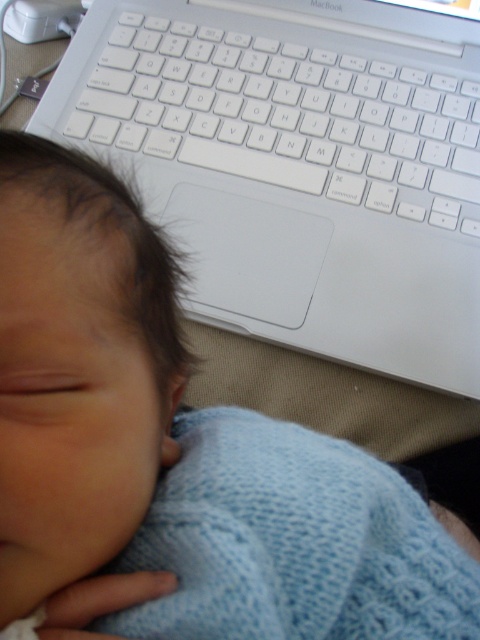
At what (x,y) coordinates should I click in order to perform the action: click on soft blue knit at lower left. Please return your answer as a coordinate pair (x, y). This screenshot has height=640, width=480. Looking at the image, I should click on (78, 368).

Consider the image. Between soft blue knit at lower left and knitted blue blanket at lower left, which one has less height?

With less height is knitted blue blanket at lower left.

Where is `soft blue knit at lower left`? This screenshot has width=480, height=640. soft blue knit at lower left is located at coordinates (78, 368).

Locate an element on the screen. The width and height of the screenshot is (480, 640). soft blue knit at lower left is located at coordinates (78, 368).

Between white plastic keyboard at upper center and knitted blue blanket at lower left, which one appears on the left side from the viewer's perspective?

Positioned to the left is white plastic keyboard at upper center.

Does white plastic keyboard at upper center lie in front of knitted blue blanket at lower left?

No, white plastic keyboard at upper center is further to the viewer.

The image size is (480, 640). Find the location of `white plastic keyboard at upper center`. white plastic keyboard at upper center is located at coordinates (287, 106).

Find the location of a particular element. This screenshot has height=640, width=480. white plastic keyboard at upper center is located at coordinates (287, 106).